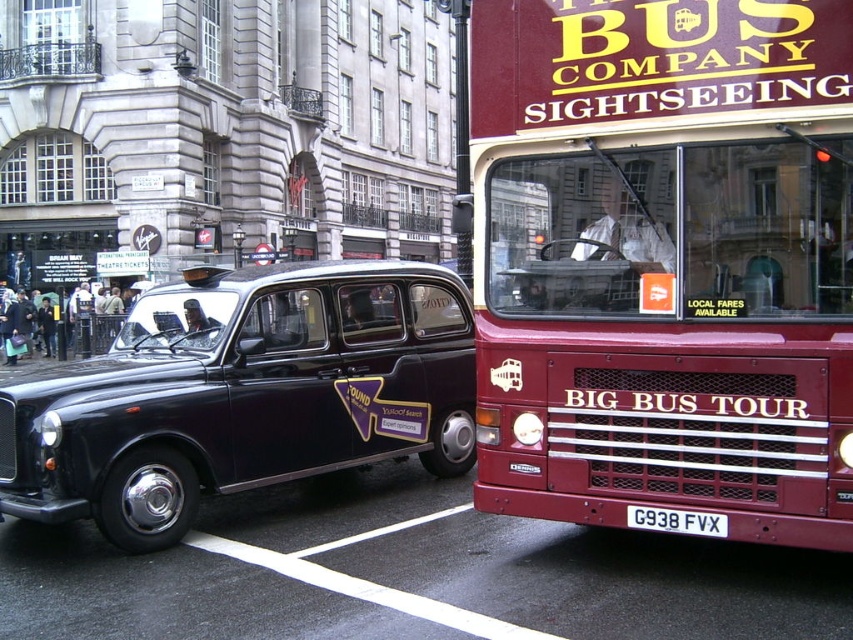
Is maroon metallic bus at center smaller than white plastic license plate at center?

No, maroon metallic bus at center is not smaller than white plastic license plate at center.

Between point (646, 504) and point (697, 516), which one is positioned in front?

Point (697, 516)

You are a GUI agent. You are given a task and a screenshot of the screen. Output one action in this format:
    pyautogui.click(x=<x>, y=<y>)
    Task: Click on the maroon metallic bus at center
    
    Given the screenshot: What is the action you would take?
    pyautogui.click(x=664, y=260)

Can you confirm if dark purple leather car at left is positioned to the right of white plastic license plate at center?

In fact, dark purple leather car at left is to the left of white plastic license plate at center.

The image size is (853, 640). What are the coordinates of `dark purple leather car at left` in the screenshot? It's located at pos(96,323).

The width and height of the screenshot is (853, 640). Identify the location of dark purple leather car at left. (96, 323).

Which is behind, point (677, 29) or point (151, 292)?

Positioned behind is point (151, 292).

Can you confirm if maroon metallic bus at center is positioned above shiny black taxi at center?

Yes, maroon metallic bus at center is above shiny black taxi at center.

What are the coordinates of `maroon metallic bus at center` in the screenshot? It's located at (664, 260).